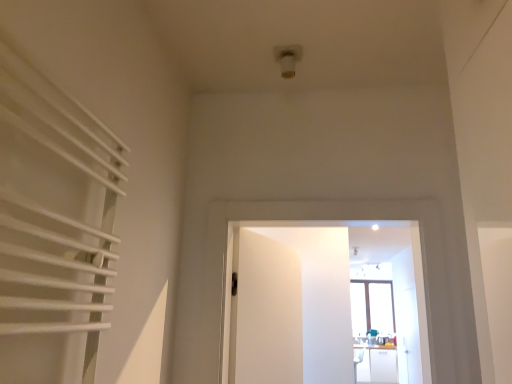
The height and width of the screenshot is (384, 512). Describe the element at coordinates (53, 227) in the screenshot. I see `white matte blind at left` at that location.

The height and width of the screenshot is (384, 512). Identify the location of white matte blind at left. (53, 227).

Find the location of a particular element. This screenshot has height=384, width=512. white matte blind at left is located at coordinates (53, 227).